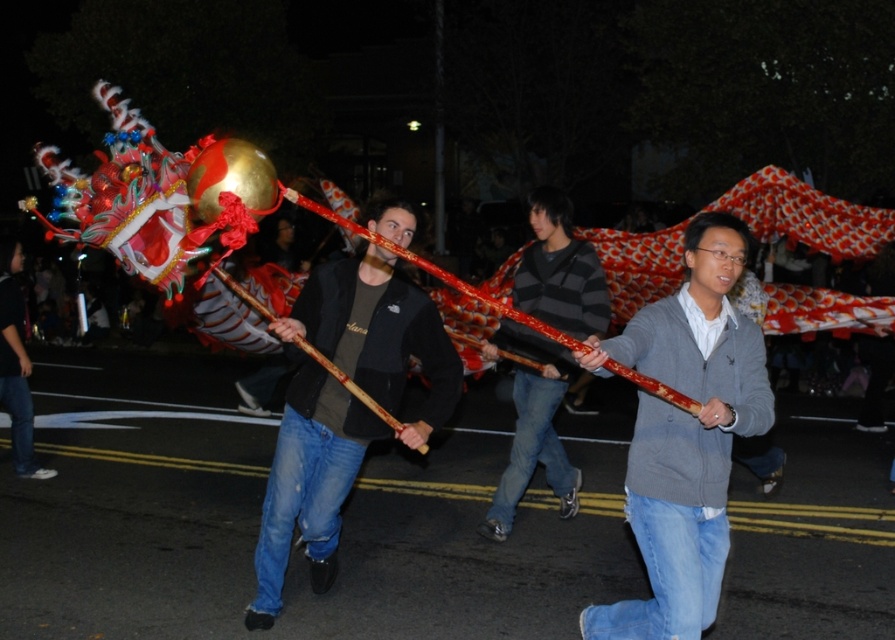
You are a photographer trying to capture the dragon head in the nighttime parade. You notice two participants wearing a gray sweater at center and a matte black jacket at center. Which participant should you focus on to ensure the dragon head is clearly visible in your shot?

The gray sweater at center is in front of the matte black jacket at center, so focusing on the participant wearing the gray sweater at center would ensure the dragon head is more clearly visible as they are closer to the camera.

You are a photographer at the parade and want to capture both the matte black jacket at center and the striped sweater at center in a single frame. Considering their widths, which one should you focus on to ensure both fit comfortably in the photo?

The matte black jacket at center is wider than the striped sweater at center. To ensure both fit comfortably in the photo, focus on the matte black jacket at center as the wider object, allowing space for the narrower striped sweater at center.